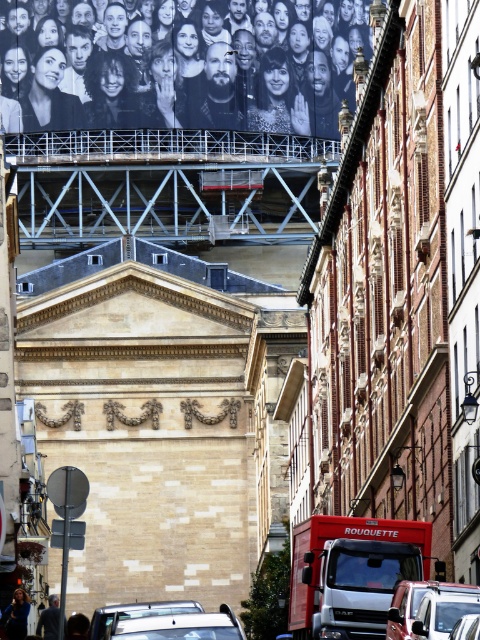
Question: Can you confirm if metallic silver van at lower right is positioned to the left of silver metallic car at lower center?

Choices:
 (A) yes
 (B) no

Answer: (B)

Question: Which point is closer to the camera taking this photo?

Choices:
 (A) (346, 547)
 (B) (144, 627)
 (C) (458, 620)
 (D) (100, 624)

Answer: (C)

Question: Observing the image, what is the correct spatial positioning of silver metallic car at center in reference to metallic silver van at lower right?

Choices:
 (A) above
 (B) below

Answer: (B)

Question: Does matte black billboard at upper center appear over red matte truck at center?

Choices:
 (A) yes
 (B) no

Answer: (A)

Question: Among these points, which one is nearest to the camera?

Choices:
 (A) (470, 621)
 (B) (395, 628)
 (C) (180, 611)
 (D) (179, 28)

Answer: (A)

Question: Which point is closer to the camera?

Choices:
 (A) silver metallic car at lower center
 (B) red matte truck at center
 (C) metallic silver van at lower right

Answer: (C)